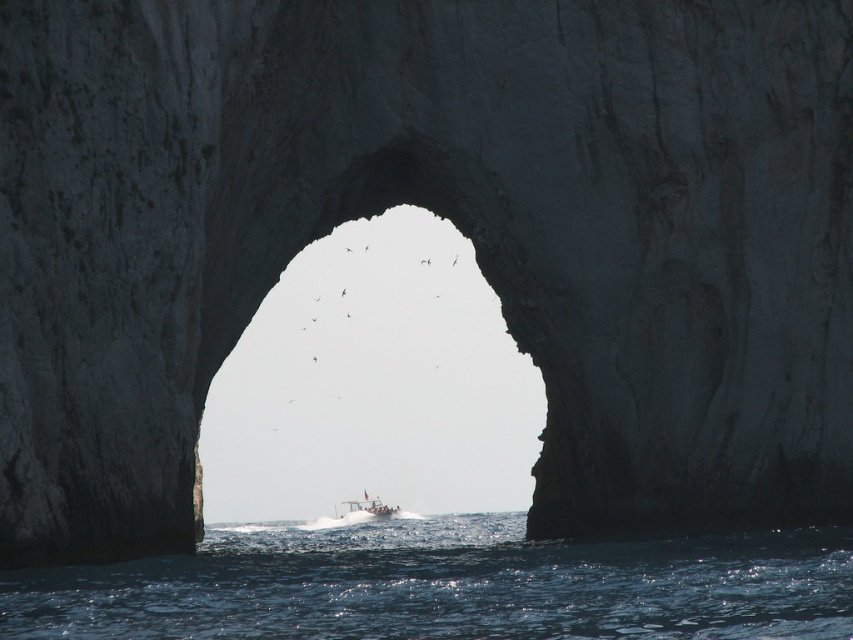
You are a photographer planning to capture the white plastic boat at center passing through the natural archway. Considering the blue liquid water at lower center, how does the size of the boat compare to the water in the image?

The blue liquid water at lower center is larger in size than the white plastic boat at center, so the boat will appear smaller in comparison to the water in the image.

You are a photographer standing at the base of the natural rock archway. You want to take a photo of the white plastic boat at center and the blue liquid water at lower center. How far apart are these two objects in your frame?

The blue liquid water at lower center is 34.34 meters from the white plastic boat at center, so they are 34.34 meters apart in your frame.